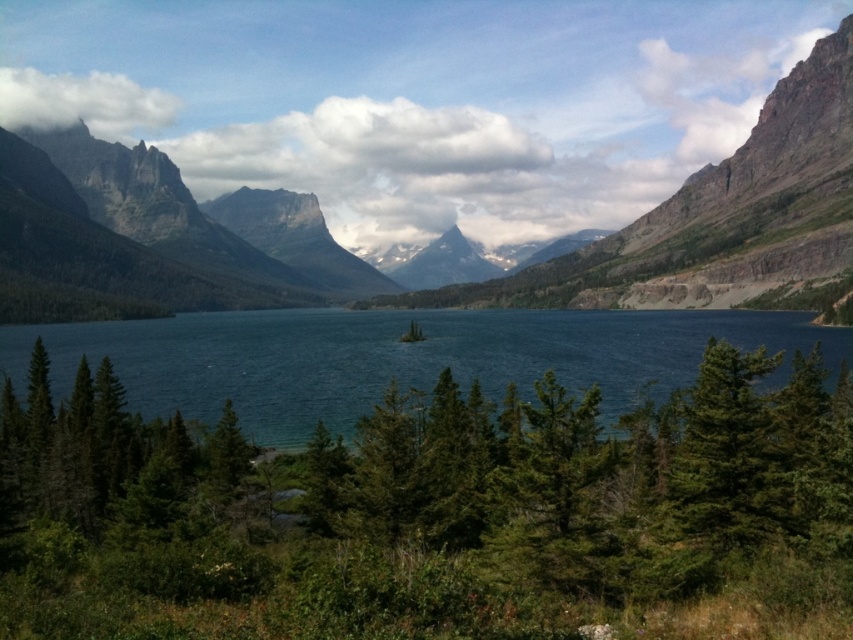
You are planning to take a photo of the rugged granite mountain at left and the green matte tree at lower right. Which object should you focus on first if you want to capture both in a single frame without moving the camera?

You should focus on the rugged granite mountain at left first because it is larger than the green matte tree at lower right, allowing it to be more prominent in the frame while still including the smaller tree in the background.

You are a hiker planning to take a photo of the green matte tree at center and the green matte tree at lower right from a viewpoint that is equidistant from both trees. Which tree will appear wider in your photo?

The green matte tree at center will appear wider in the photo because its width is larger than the green matte tree at lower right.